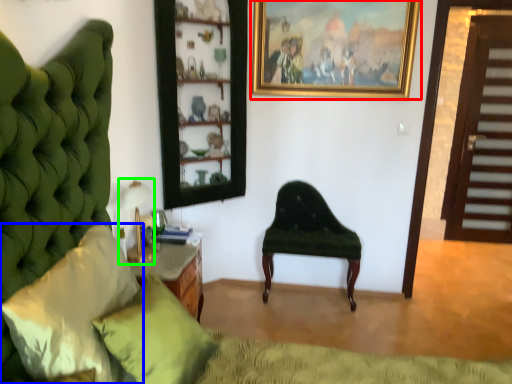
Question: Estimate the real-world distances between objects in this image. Which object is farther from picture frame (highlighted by a red box), pillow (highlighted by a blue box) or table lamp (highlighted by a green box)?

Choices:
 (A) pillow
 (B) table lamp

Answer: (A)